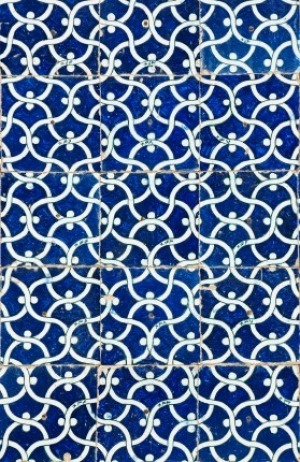
Find the location of a particular element. This screenshot has width=300, height=462. row 1 of tile is located at coordinates (157, 42).